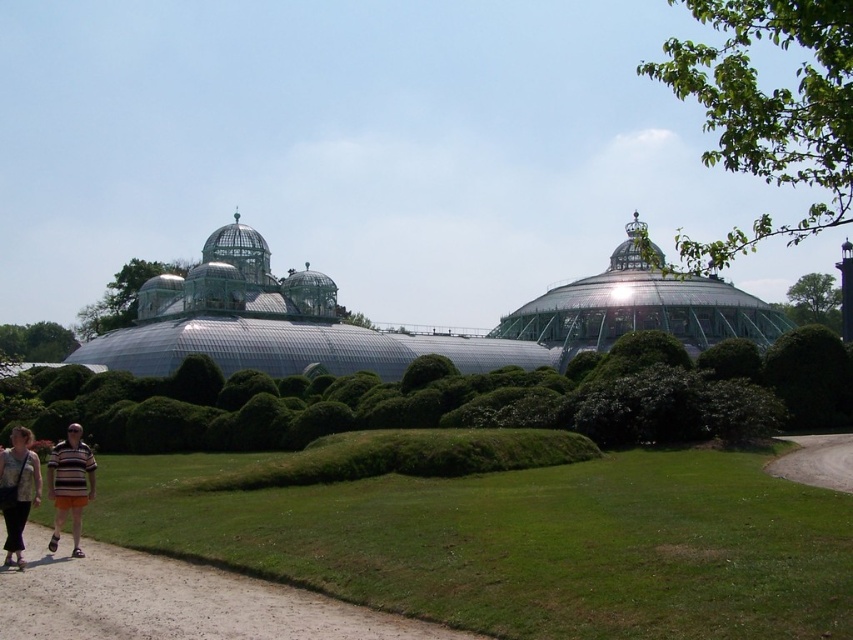
You are standing at the entrance of the greenhouse and want to take a photo. There are two points in the scene marked as point 1 at coordinates point (x=490, y=376) and point 2 at coordinates point (x=9, y=532). Which point should you focus on to ensure it appears closer to the camera in your photo?

Point 1 at coordinates point (x=490, y=376) is further to the camera than point (x=9, y=532), so focusing on point 1 will make it appear closer in the photo.

Consider the image. You are a drone operator trying to capture the greenhouse from above. You have two points marked in the image, point A at coordinates point (38, 561) and point B at coordinates point (16, 564). Which point should you focus on to ensure the camera is closer to the greenhouse structure?

Point A at coordinates point (38, 561) is further to the camera than point B at coordinates point (16, 564), so focusing on point A would place the camera closer to the greenhouse structure.

Based on the photo, you are standing at the point marked by coordinates point (402,328) in the greenhouse complex. What structure are you currently inside?

Result: You are inside the transparent glass conservatory at center, as the point (402,328) represents its location.